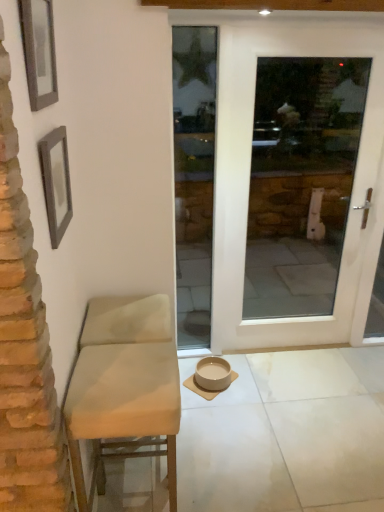
Question: Does beige fabric chair at left have a larger size compared to beige matte tile at center?

Choices:
 (A) yes
 (B) no

Answer: (A)

Question: Is beige matte tile at center surrounded by beige fabric chair at left?

Choices:
 (A) yes
 (B) no

Answer: (B)

Question: Can you confirm if beige fabric chair at left is wider than beige matte tile at center?

Choices:
 (A) no
 (B) yes

Answer: (B)

Question: Could you tell me if beige fabric chair at left is turned towards beige matte tile at center?

Choices:
 (A) yes
 (B) no

Answer: (B)

Question: From the image's perspective, is beige fabric chair at left under beige matte tile at center?

Choices:
 (A) no
 (B) yes

Answer: (A)

Question: Is point tap(233, 306) positioned closer to the camera than point tap(91, 368)?

Choices:
 (A) closer
 (B) farther

Answer: (B)

Question: Is white glossy door at center to the left or to the right of beige fabric chair at left in the image?

Choices:
 (A) left
 (B) right

Answer: (B)

Question: In terms of height, does white glossy door at center look taller or shorter compared to beige fabric chair at left?

Choices:
 (A) tall
 (B) short

Answer: (A)

Question: From a real-world perspective, is white glossy door at center physically located above or below beige fabric chair at left?

Choices:
 (A) below
 (B) above

Answer: (B)

Question: Visually, is wooden picture frame at upper left, the first picture frame in the top-to-bottom sequence, positioned to the left or to the right of beige fabric chair at left?

Choices:
 (A) right
 (B) left

Answer: (B)

Question: In terms of width, does wooden picture frame at upper left, which is the second picture frame from bottom to top, look wider or thinner when compared to beige fabric chair at left?

Choices:
 (A) thin
 (B) wide

Answer: (A)

Question: Relative to beige fabric chair at left, is wooden picture frame at upper left, the first picture frame in the top-to-bottom sequence, in front or behind?

Choices:
 (A) behind
 (B) front

Answer: (B)

Question: From a real-world perspective, is wooden picture frame at upper left, which is the second picture frame from bottom to top, physically located above or below beige fabric chair at left?

Choices:
 (A) above
 (B) below

Answer: (A)

Question: Would you say wooden picture frame at upper left, the first picture frame in the top-to-bottom sequence, is inside or outside beige ceramic bowl at center?

Choices:
 (A) outside
 (B) inside

Answer: (A)

Question: Relative to beige ceramic bowl at center, is wooden picture frame at upper left, the first picture frame in the top-to-bottom sequence, in front or behind?

Choices:
 (A) behind
 (B) front

Answer: (B)